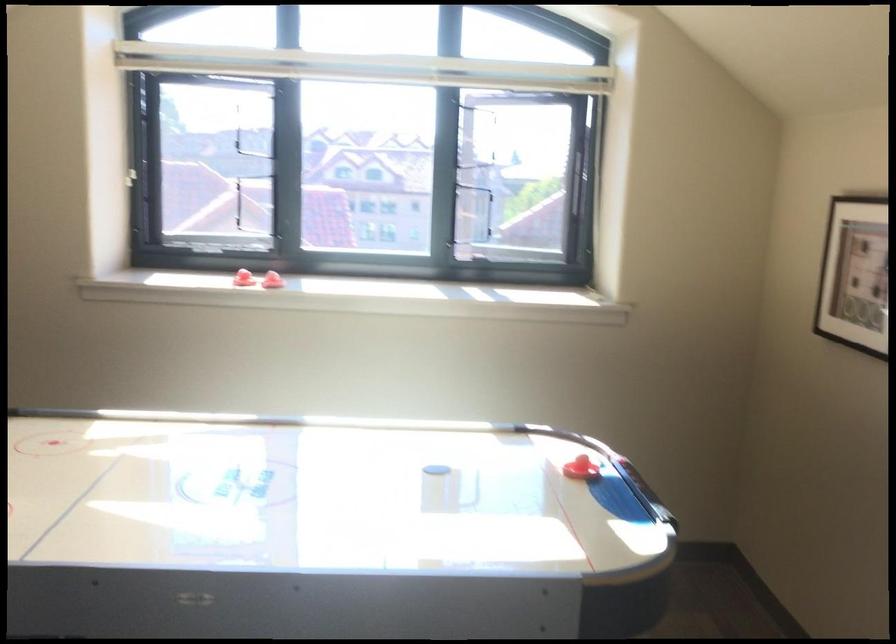
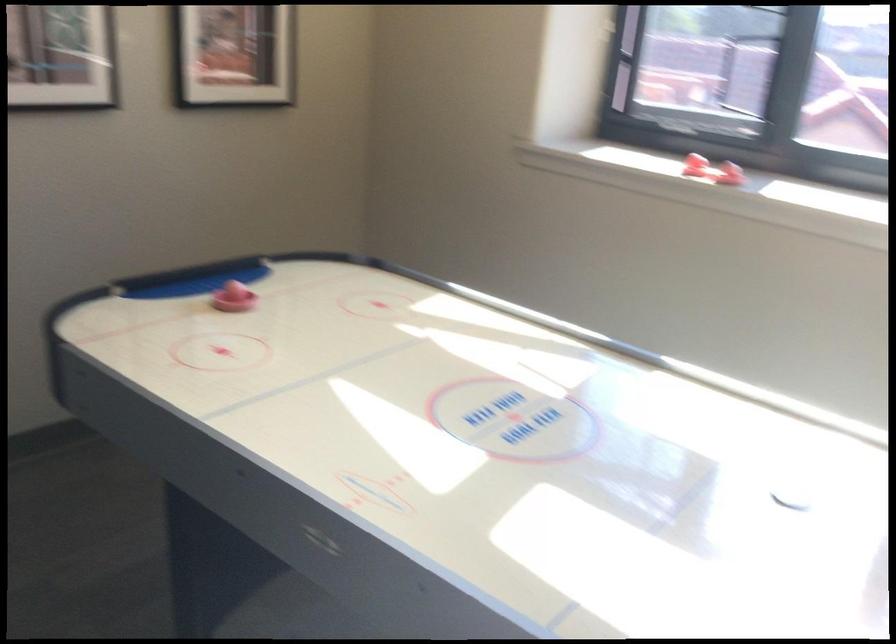
Question: The first image is from the beginning of the video and the second image is from the end. How did the camera likely rotate when shooting the video?

Choices:
 (A) Left
 (B) Right
 (C) Up
 (D) Down

Answer: (A)